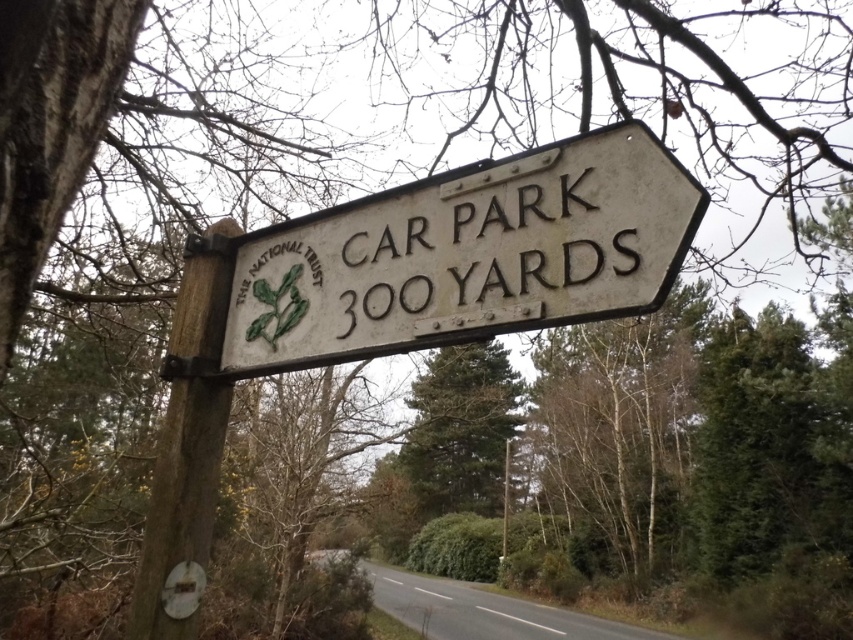
You are a hiker who wants to know the distance between the white wooden sign at center and the brown wood pole at left. According to the sign, how far apart are they?

The white wooden sign at center is 24.20 inches from the brown wood pole at left, so the distance between them is 24.20 inches.

You are a hiker trying to read the white wooden sign at center attached to the brown wood pole at left. Can you see the entire sign clearly from your current position?

Yes, the white wooden sign at center is in front of the brown wood pole at left, so you can see the entire sign clearly from your current position.